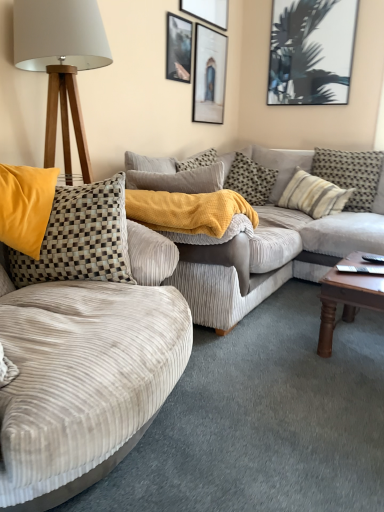
Question: Is matte glass picture frame at upper center, the third picture frame positioned from the left, turned away from wooden tripod lamp at left?

Choices:
 (A) yes
 (B) no

Answer: (B)

Question: Is matte glass picture frame at upper center, the third picture frame positioned from the left, at the right side of wooden tripod lamp at left?

Choices:
 (A) yes
 (B) no

Answer: (A)

Question: From the image's perspective, is matte glass picture frame at upper center, the third picture frame positioned from the left, below wooden tripod lamp at left?

Choices:
 (A) no
 (B) yes

Answer: (A)

Question: Considering the relative positions of matte glass picture frame at upper center, the third picture frame positioned from the left, and wooden tripod lamp at left in the image provided, is matte glass picture frame at upper center, the third picture frame positioned from the left, to the left of wooden tripod lamp at left from the viewer's perspective?

Choices:
 (A) yes
 (B) no

Answer: (B)

Question: Can you confirm if matte glass picture frame at upper center, which is the 2th picture frame from right to left, is shorter than wooden tripod lamp at left?

Choices:
 (A) yes
 (B) no

Answer: (A)

Question: Is matte black picture frame at upper right, the fourth picture frame from the left, taller or shorter than metallic silver picture frame at upper center, placed as the 1th picture frame when sorted from left to right?

Choices:
 (A) short
 (B) tall

Answer: (B)

Question: From a real-world perspective, is matte black picture frame at upper right, the 1th picture frame when ordered from right to left, positioned above or below metallic silver picture frame at upper center, the fourth picture frame viewed from the right?

Choices:
 (A) above
 (B) below

Answer: (A)

Question: Does point (329, 26) appear closer or farther from the camera than point (188, 65)?

Choices:
 (A) closer
 (B) farther

Answer: (B)

Question: Is matte black picture frame at upper right, the 1th picture frame when ordered from right to left, in front of or behind metallic silver picture frame at upper center, the fourth picture frame viewed from the right, in the image?

Choices:
 (A) front
 (B) behind

Answer: (B)

Question: In terms of width, does matte black picture frame at upper center, positioned as the 3th picture frame in right-to-left order, look wider or thinner when compared to checkered fabric pillow at center, which is counted as the second pillow, starting from the left?

Choices:
 (A) thin
 (B) wide

Answer: (A)

Question: In terms of size, does matte black picture frame at upper center, positioned as the 3th picture frame in right-to-left order, appear bigger or smaller than checkered fabric pillow at center, the 4th pillow when ordered from right to left?

Choices:
 (A) small
 (B) big

Answer: (A)

Question: Which is correct: matte black picture frame at upper center, positioned as the 3th picture frame in right-to-left order, is inside checkered fabric pillow at center, the 4th pillow when ordered from right to left, or outside of it?

Choices:
 (A) inside
 (B) outside

Answer: (B)

Question: Would you say matte black picture frame at upper center, positioned as the 3th picture frame in right-to-left order, is to the left or to the right of checkered fabric pillow at center, which is counted as the second pillow, starting from the left, in the picture?

Choices:
 (A) right
 (B) left

Answer: (B)

Question: Is checkered fabric pillow at center, which is counted as the second pillow, starting from the left, to the left or to the right of velvet beige couch at left, which is counted as the second studio couch, starting from the back, in the image?

Choices:
 (A) left
 (B) right

Answer: (B)

Question: Choose the correct answer: Is checkered fabric pillow at center, the 4th pillow when ordered from right to left, inside velvet beige couch at left, arranged as the first studio couch when viewed from the front, or outside it?

Choices:
 (A) inside
 (B) outside

Answer: (B)